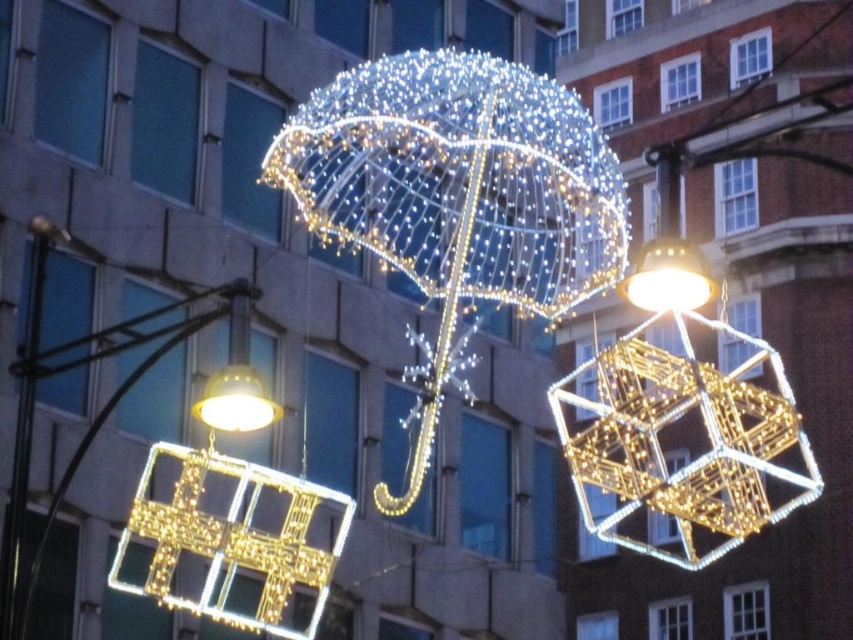
You are a delivery drone that needs to fly from the iridescent glass cube at center to the matte gold cube at upper center. What is the minimum distance you must travel between them?

The minimum distance you must travel between the iridescent glass cube at center and the matte gold cube at upper center is 44.69 feet.

You are standing in front of the festive display and want to take a photo of the iridescent glass cube at center. If your camera can focus on objects up to 50 meters away, will you be able to take a clear photo?

The iridescent glass cube at center is 52.41 meters away from the viewer, which exceeds the camera focus limit of 50 meters. Therefore, the camera cannot focus clearly on the iridescent glass cube at center.